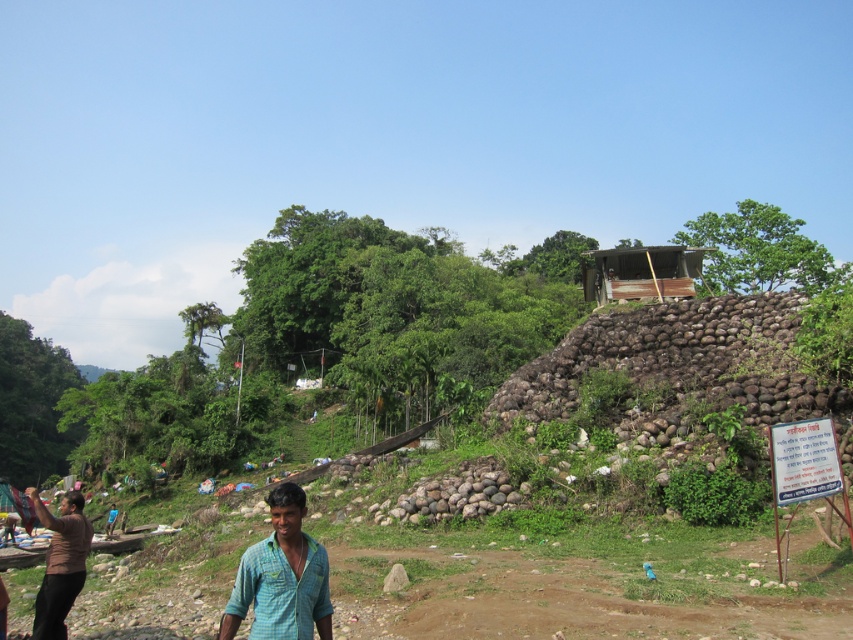
Between green checkered shirt at lower center and weathered wood hut at upper right, which one is positioned higher?

weathered wood hut at upper right is higher up.

Can you confirm if green checkered shirt at lower center is shorter than weathered wood hut at upper right?

Correct, green checkered shirt at lower center is not as tall as weathered wood hut at upper right.

Who is more distant from viewer, (292,614) or (624,292)?

The point (624,292) is more distant.

Find the location of a particular element. This screenshot has height=640, width=853. green checkered shirt at lower center is located at coordinates (281, 577).

Can you confirm if weathered wood hut at upper right is smaller than brown matte shirt at lower left?

No, weathered wood hut at upper right is not smaller than brown matte shirt at lower left.

Who is lower down, weathered wood hut at upper right or brown matte shirt at lower left?

brown matte shirt at lower left

Is point (660, 288) positioned after point (35, 499)?

Yes.

Locate an element on the screen. The height and width of the screenshot is (640, 853). weathered wood hut at upper right is located at coordinates [641, 273].

Who is higher up, green checkered shirt at lower center or brown matte shirt at lower left?

green checkered shirt at lower center is higher up.

Who is more distant from viewer, (283,524) or (56,532)?

Point (56,532)

Is point (276, 586) farther from camera compared to point (71, 522)?

That is False.

Where is `green checkered shirt at lower center`? Image resolution: width=853 pixels, height=640 pixels. green checkered shirt at lower center is located at coordinates (281, 577).